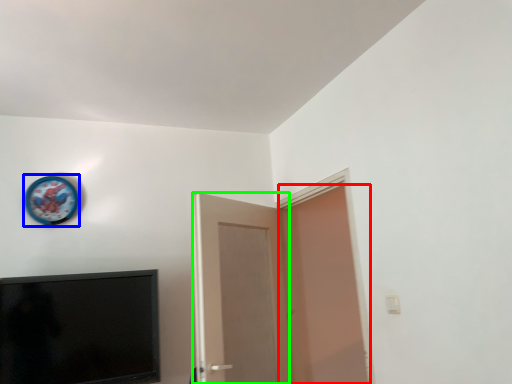
Question: Which object is positioned farthest from door (highlighted by a red box)? Select from clock (highlighted by a blue box) and door (highlighted by a green box).

Choices:
 (A) clock
 (B) door

Answer: (A)